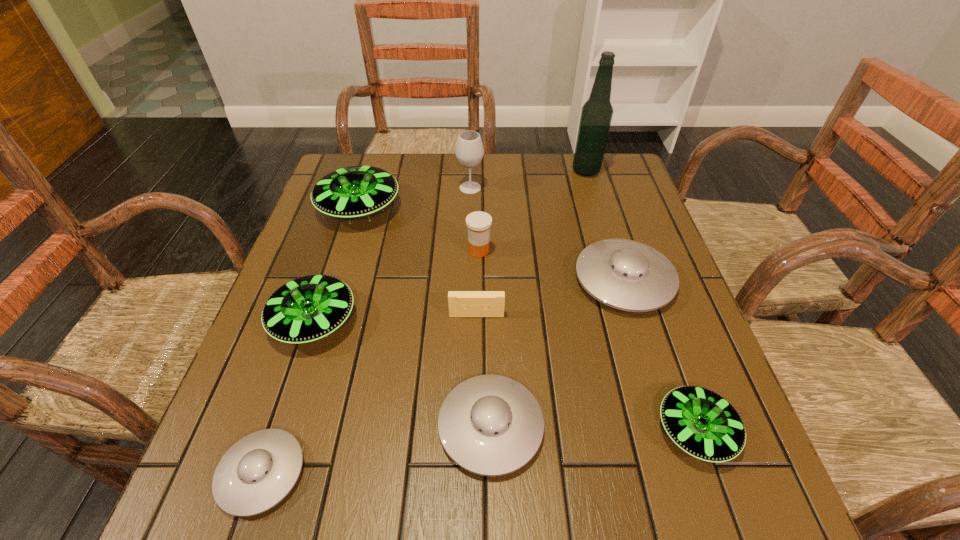
Locate an element on the screen. The image size is (960, 540). green saucer that is the third closest to the ninth shortest object is located at coordinates (702, 423).

Find the location of a particular element. the second closest gray saucer to the nearest green saucer is located at coordinates (491, 425).

The height and width of the screenshot is (540, 960). In order to click on gray saucer object that ranks as the closest to the fifth shortest saucer in this screenshot , I will do click(x=258, y=471).

Identify the location of free spot that satisfies the following two spatial constraints: 1. on the front side of the smallest green saucer; 2. on the left side of the fourth saucer from left to right. (491, 431).